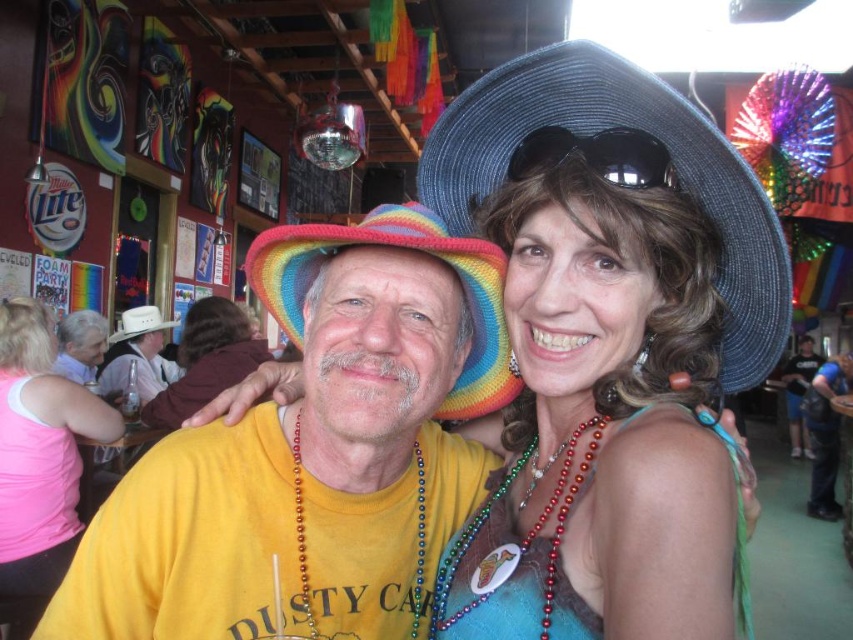
Question: Which object is the farthest from the matte yellow shirt at center?

Choices:
 (A) shiny blue dress at center
 (B) blue straw hat at upper right
 (C) white fabric hat at left

Answer: (A)

Question: Can you confirm if white leather cowboy hat at left is smaller than white fabric hat at left?

Choices:
 (A) no
 (B) yes

Answer: (A)

Question: Does yellow cotton shirt at center appear on the right side of rainbow knitted hat at center?

Choices:
 (A) no
 (B) yes

Answer: (A)

Question: Can you confirm if matte yellow shirt at center is positioned to the right of white leather cowboy hat at left?

Choices:
 (A) no
 (B) yes

Answer: (B)

Question: Which point is farther from the camera taking this photo?

Choices:
 (A) (578, 481)
 (B) (786, 403)
 (C) (416, 486)
 (D) (302, 266)

Answer: (B)

Question: Estimate the real-world distances between objects in this image. Which object is farther from the shiny blue dress at center?

Choices:
 (A) red beaded necklace at center
 (B) rainbow knitted hat at center

Answer: (B)